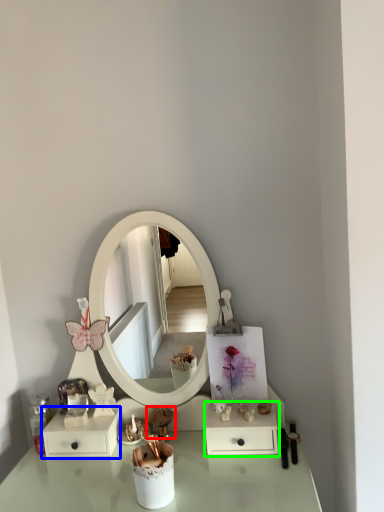
Question: Which object is the farthest from toy (highlighted by a red box)? Choose among these: dresser (highlighted by a blue box) or dresser (highlighted by a green box).

Choices:
 (A) dresser
 (B) dresser

Answer: (B)